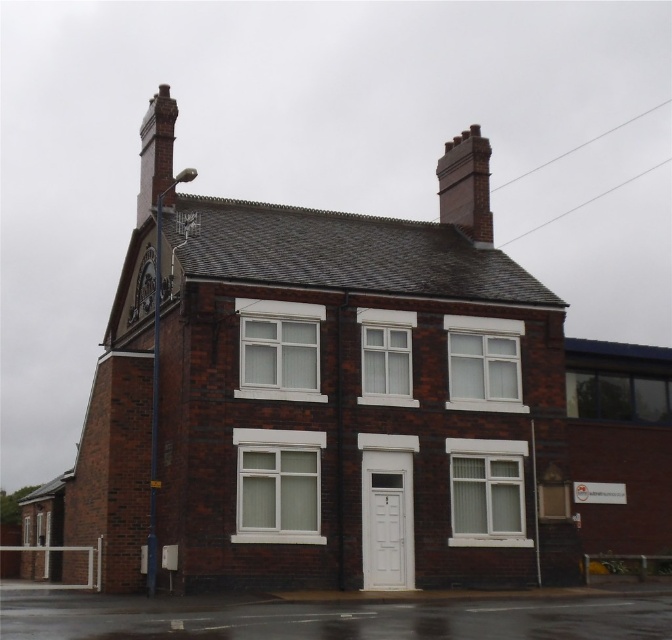
You are an architect analyzing the symmetry of the building. Given that both brick chimney at upper right and red brick chimney at upper left are present, which one takes up more space on the building facade?

The red brick chimney at upper left takes up more space than the brick chimney at upper right, as stated in the description.

You are an architect analyzing the symmetry of the two brick chimneys on the roof. Which chimney is narrower in width between the brick chimney at upper right and the red brick chimney at upper left?

The brick chimney at upper right is narrower in width compared to the red brick chimney at upper left.

You are a drone operator tasked with inspecting two chimneys on a building. You have a drone that can fly up to 15 meters. The dark red brick chimney at center and the brick chimney at upper right are both visible from your current position. Which chimney requires the drone to ascend higher to reach its top?

The brick chimney at upper right requires the drone to ascend higher because the dark red brick chimney at center has a lesser height compared to it.